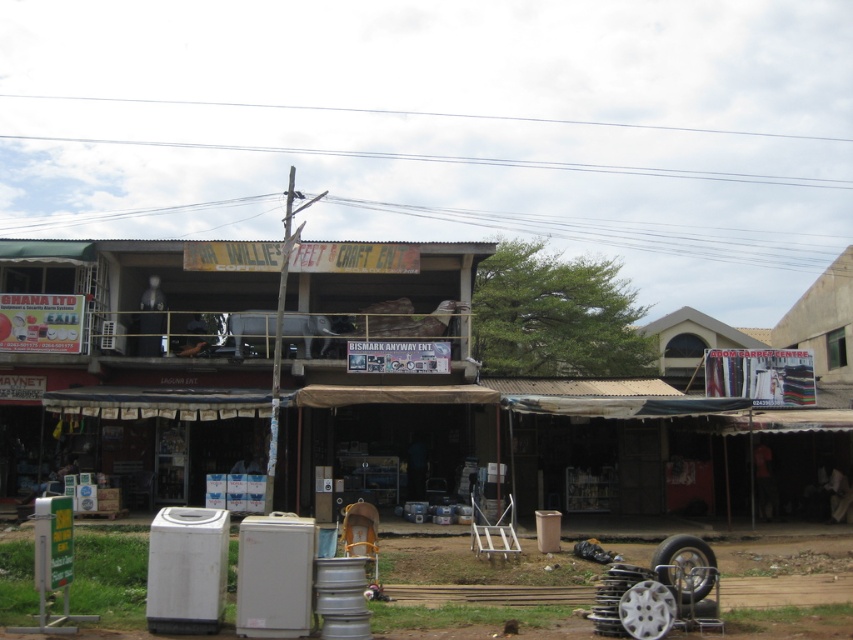
You are a delivery person trying to park your delivery van between the black rubber tire at lower right and the silver metallic tire at lower center. The van is 18 feet long. Can you fit the van between them?

The distance between the black rubber tire at lower right and the silver metallic tire at lower center is 17.53 inches. Since the van is 18 feet long, which is significantly longer than the available space, the van cannot fit between them.

You are a delivery person with a cart that is 2 meters wide. You need to move from the brown corrugated metal hut at center to the black rubber tire at lower right. Is there enough space between them for your cart to pass through?

The distance between the brown corrugated metal hut at center and the black rubber tire at lower right is 13.80 meters. Since the cart is only 2 meters wide, there is sufficient space for the cart to pass through as the distance is much greater than the cart width.

You are a delivery person who needs to place a heavy box on the silver metallic tire at lower center. However, there is a striped fabric tent at right covering it. Can you place the box directly on the tire without moving the tent?

The striped fabric tent at right is positioned over the silver metallic tire at lower center, so you cannot place the box directly on the tire without moving the tent.